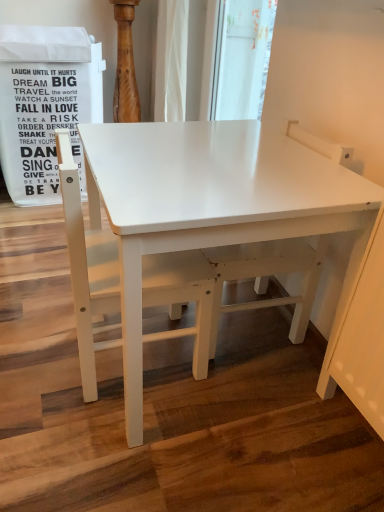
Measure the distance between white matte swivel chair at center and camera.

The distance of white matte swivel chair at center from camera is 35.35 inches.

What do you see at coordinates (199, 232) in the screenshot? The image size is (384, 512). I see `white matte table at center` at bounding box center [199, 232].

The height and width of the screenshot is (512, 384). What do you see at coordinates (88, 264) in the screenshot? I see `white matte chair at left` at bounding box center [88, 264].

Locate an element on the screen. The image size is (384, 512). white matte swivel chair at center is located at coordinates (268, 277).

From a real-world perspective, is white matte chair at left physically above white matte table at center?

Yes, from a real-world perspective, white matte chair at left is on top of white matte table at center.

Between white matte chair at left and white matte table at center, which one has more height?

With more height is white matte table at center.

Who is smaller, white matte chair at left or white matte table at center?

white matte chair at left is smaller.

Between white matte chair at left and white matte swivel chair at center, which one appears on the left side from the viewer's perspective?

white matte chair at left is more to the left.

Between white matte chair at left and white matte swivel chair at center, which one has larger width?

With larger width is white matte chair at left.

Looking at this image, from a real-world perspective, is white matte chair at left under white matte swivel chair at center?

No, from a real-world perspective, white matte chair at left is not beneath white matte swivel chair at center.

Is white matte chair at left facing towards white matte swivel chair at center?

Yes, white matte chair at left faces towards white matte swivel chair at center.

Is point (271, 271) behind point (89, 365)?

Yes, point (271, 271) is farther from viewer.

Does white matte swivel chair at center turn towards white matte chair at left?

Yes, white matte swivel chair at center faces towards white matte chair at left.

Considering the positions of objects white matte swivel chair at center and white matte chair at left in the image provided, who is more to the left, white matte swivel chair at center or white matte chair at left?

white matte chair at left.

From the image's perspective, who appears lower, white matte swivel chair at center or white matte chair at left?

white matte chair at left appears lower in the image.

Is white matte table at center placed right next to white matte swivel chair at center?

No, white matte table at center is not in contact with white matte swivel chair at center.

Can you confirm if white matte table at center is bigger than white matte swivel chair at center?

Indeed, white matte table at center has a larger size compared to white matte swivel chair at center.

Where is `table located in front of the white matte swivel chair at center`? table located in front of the white matte swivel chair at center is located at coordinates (199, 232).

Is white matte swivel chair at center with white matte table at center?

No, white matte swivel chair at center is not beside white matte table at center.

From the image's perspective, which one is positioned lower, white matte swivel chair at center or white matte table at center?

white matte table at center.

From a real-world perspective, between white matte swivel chair at center and white matte table at center, who is vertically higher?

white matte swivel chair at center, from a real-world perspective.

Does white matte swivel chair at center appear on the left side of white matte table at center?

In fact, white matte swivel chair at center is to the right of white matte table at center.

Can you confirm if white matte table at center is thinner than white matte chair at left?

No, white matte table at center is not thinner than white matte chair at left.

Is white matte chair at left located within white matte table at center?

Yes, white matte chair at left can be found within white matte table at center.

From the picture: Is white matte table at center facing towards white matte chair at left?

Yes, white matte table at center is oriented towards white matte chair at left.

From a real-world perspective, which object stands above the other?

white matte chair at left, from a real-world perspective.

I want to click on table above the white matte chair at left (from the image's perspective), so click(x=199, y=232).

Identify the location of chair lying below the white matte swivel chair at center (from the image's perspective). Image resolution: width=384 pixels, height=512 pixels. (88, 264).

Looking at the image, which one is located closer to white matte swivel chair at center, white matte table at center or white matte chair at left?

The object closer to white matte swivel chair at center is white matte table at center.

Based on the photo, considering their positions, is white matte swivel chair at center positioned closer to white matte table at center than white matte chair at left?

The object closer to white matte table at center is white matte chair at left.

When comparing their distances from white matte table at center, does white matte chair at left or white matte swivel chair at center seem further?

white matte swivel chair at center is further to white matte table at center.

Estimate the real-world distances between objects in this image. Which object is closer to white matte chair at left, white matte table at center or white matte swivel chair at center?

white matte table at center is positioned closer to the anchor white matte chair at left.

Considering their positions, is white matte chair at left positioned further to white matte swivel chair at center than white matte table at center?

white matte chair at left is positioned further to the anchor white matte swivel chair at center.

Based on their spatial positions, is white matte swivel chair at center or white matte table at center further from white matte chair at left?

Based on the image, white matte swivel chair at center appears to be further to white matte chair at left.

At what (x,y) coordinates should I click in order to perform the action: click on table between white matte chair at left and white matte swivel chair at center from left to right. Please return your answer as a coordinate pair (x, y). The height and width of the screenshot is (512, 384). Looking at the image, I should click on (199, 232).